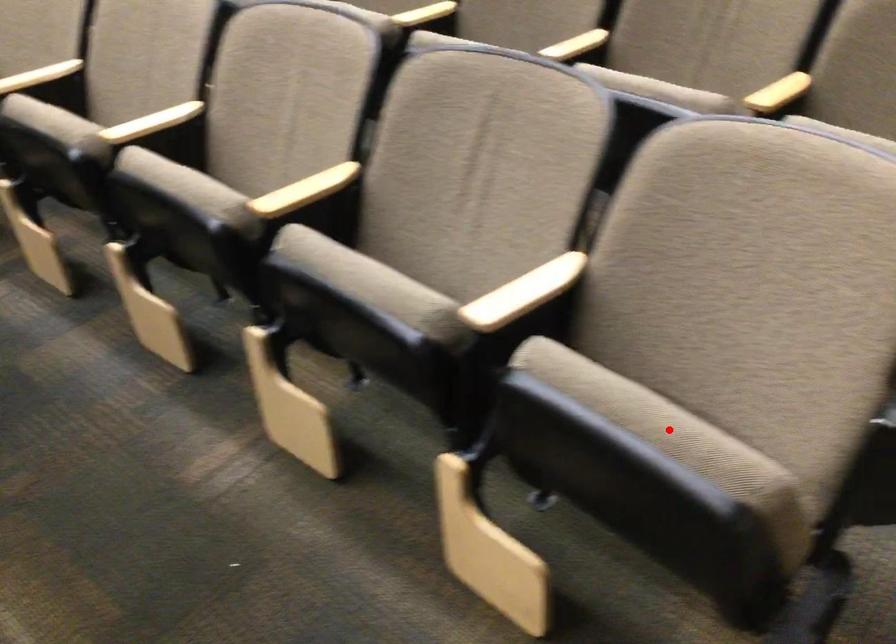
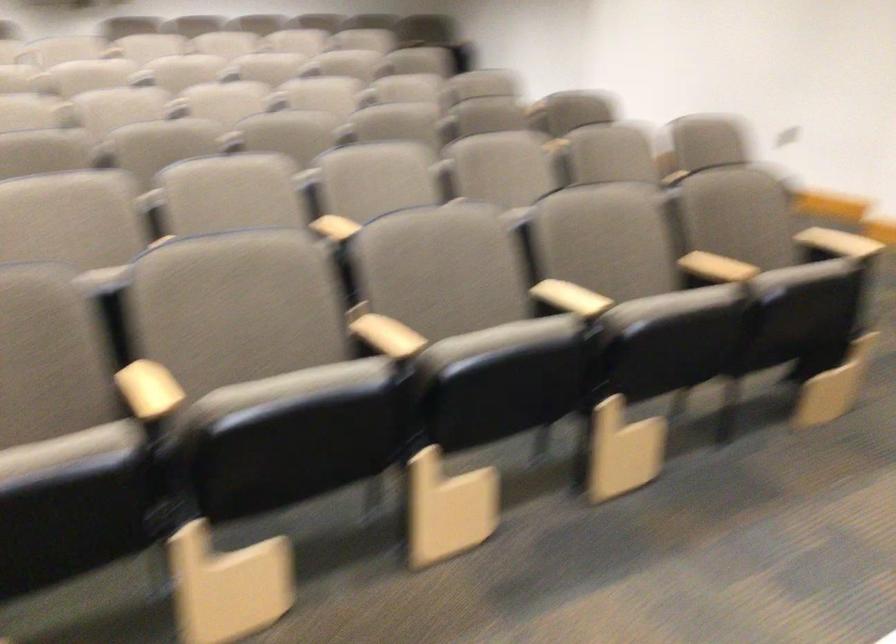
Question: I am providing you with two images of the same scene from different viewpoints. A red point is marked on the first image. At the location where the point appears in image 1, is it still visible in image 2?

Choices:
 (A) Yes
 (B) No

Answer: (B)